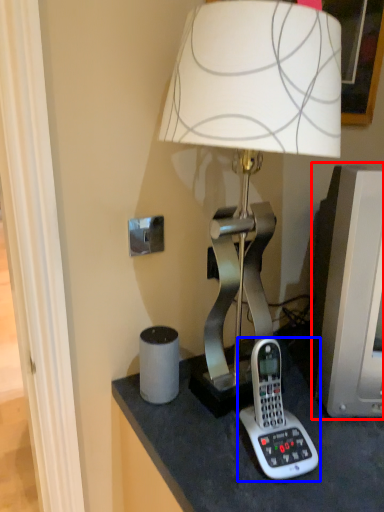
Question: Which point is closer to the camera, computer monitor (highlighted by a red box) or corded phone (highlighted by a blue box)?

Choices:
 (A) computer monitor
 (B) corded phone

Answer: (B)